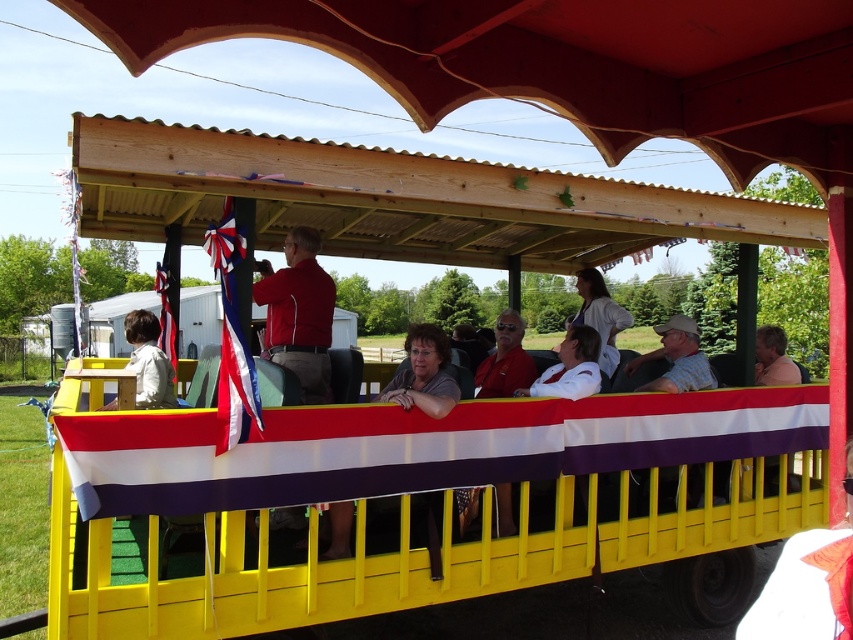
Question: Considering the relative positions of red smooth jacket at center and red-white-blue fabric flag at left in the image provided, where is red smooth jacket at center located with respect to red-white-blue fabric flag at left?

Choices:
 (A) right
 (B) left

Answer: (A)

Question: Estimate the real-world distances between objects in this image. Which object is closer to the red fabric flag at left?

Choices:
 (A) red-white-blue fabric flag at left
 (B) orange fabric at lower right
 (C) red smooth jacket at center
 (D) light beige jacket at left

Answer: (D)

Question: Among these points, which one is farthest from the camera?

Choices:
 (A) (305, 301)
 (B) (231, 216)
 (C) (801, 579)

Answer: (A)

Question: Can you confirm if red-white-blue fabric flag at left is wider than red fabric flag at left?

Choices:
 (A) no
 (B) yes

Answer: (A)

Question: Can you confirm if red smooth jacket at center is bigger than light beige jacket at left?

Choices:
 (A) yes
 (B) no

Answer: (B)

Question: Which of the following is the farthest from the observer?

Choices:
 (A) (787, 588)
 (B) (706, 378)
 (C) (242, 406)

Answer: (B)